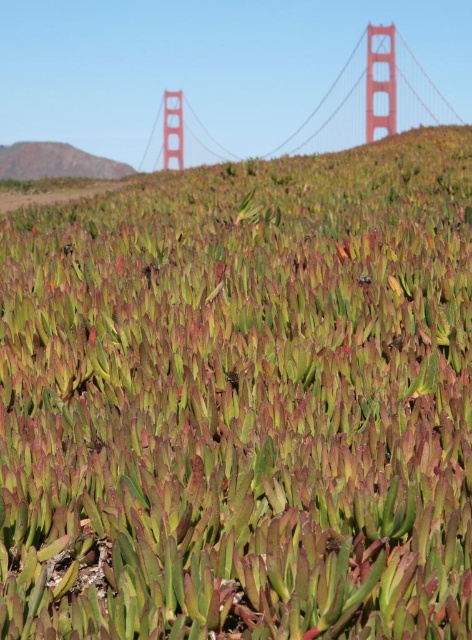
Does red painted steel golden gate bridge at upper center have a greater height compared to green grassy hillside at upper left?

Correct, red painted steel golden gate bridge at upper center is much taller as green grassy hillside at upper left.

Can you confirm if red painted steel golden gate bridge at upper center is wider than green grassy hillside at upper left?

Correct, the width of red painted steel golden gate bridge at upper center exceeds that of green grassy hillside at upper left.

Between point (396, 93) and point (44, 141), which one is positioned behind?

Positioned behind is point (396, 93).

Locate an element on the screen. This screenshot has height=640, width=472. red painted steel golden gate bridge at upper center is located at coordinates 370,99.